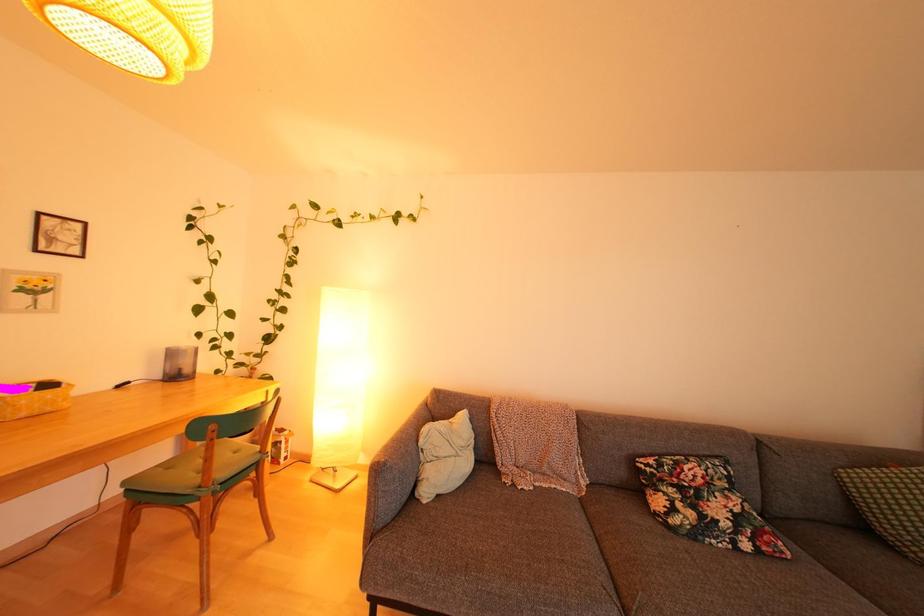
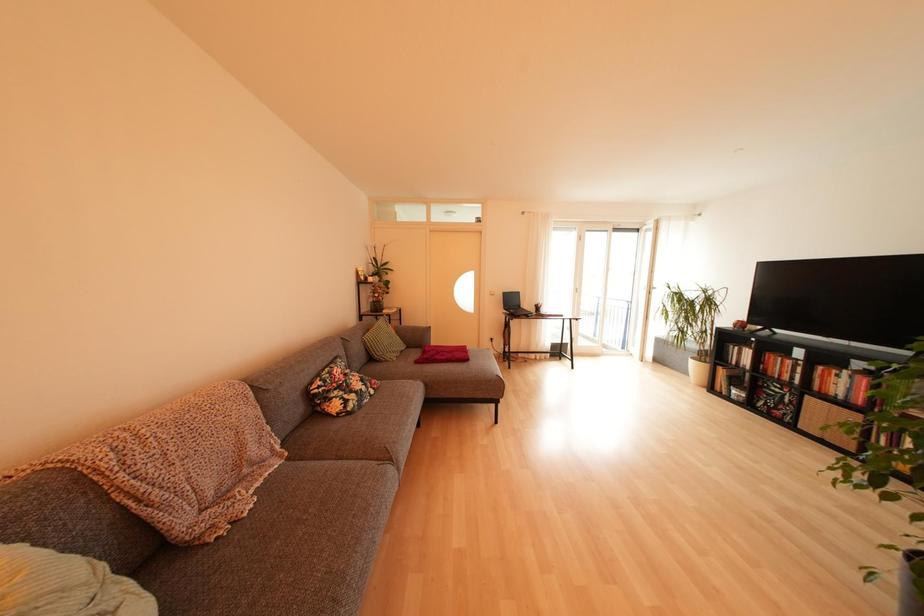
Question: The camera is either moving clockwise (left) or counter-clockwise (right) around the object. The first image is from the beginning of the video and the second image is from the end. Is the camera moving left or right when shooting the video?

Choices:
 (A) Left
 (B) Right

Answer: (A)